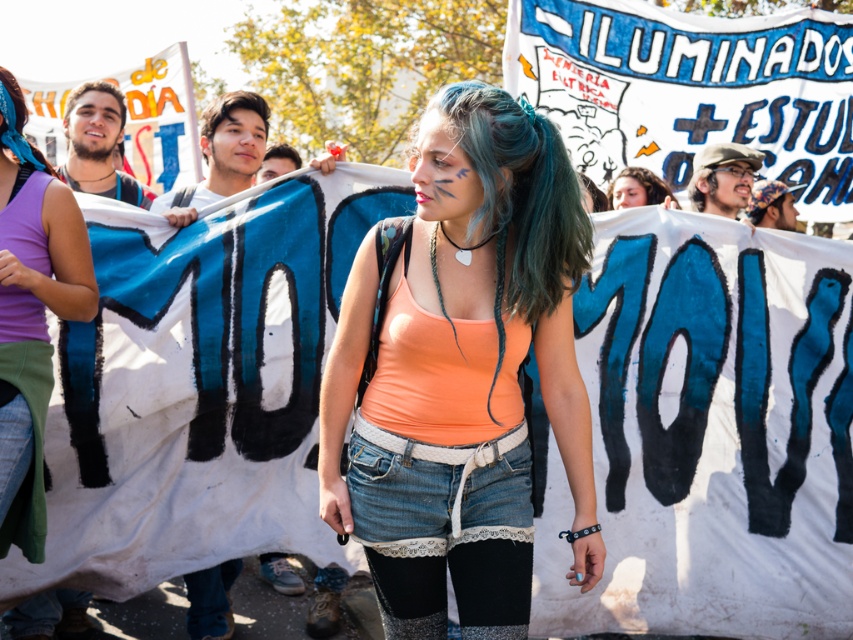
Question: Can you confirm if blue dyed hair at center is positioned to the right of brown straight hair at upper center?

Choices:
 (A) no
 (B) yes

Answer: (B)

Question: Among these objects, which one is nearest to the camera?

Choices:
 (A) matte purple tank top at left
 (B) blue dyed hair at center

Answer: (B)

Question: Can you confirm if blue dyed hair at center is positioned to the right of blue dyed hair at upper center?

Choices:
 (A) yes
 (B) no

Answer: (B)

Question: Among these points, which one is nearest to the camera?

Choices:
 (A) (560, 186)
 (B) (20, 125)

Answer: (A)

Question: Which object is positioned farthest from the brown straight hair at upper left?

Choices:
 (A) blonde hair at center
 (B) orange matte tank top at center
 (C) blue dyed hair at center

Answer: (B)

Question: From the image, what is the correct spatial relationship of orange matte tank top at center in relation to blue dyed hair at upper center?

Choices:
 (A) below
 (B) above

Answer: (A)